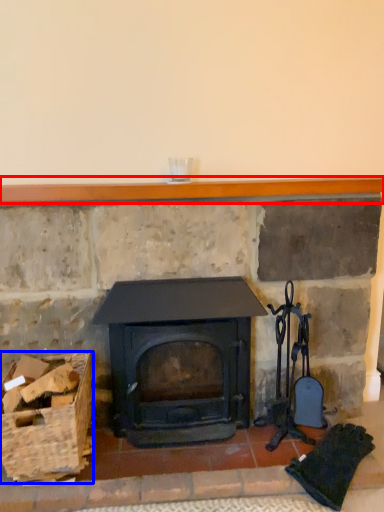
Question: Among these objects, which one is farthest to the camera, balustrade (highlighted by a red box) or basket (highlighted by a blue box)?

Choices:
 (A) balustrade
 (B) basket

Answer: (A)